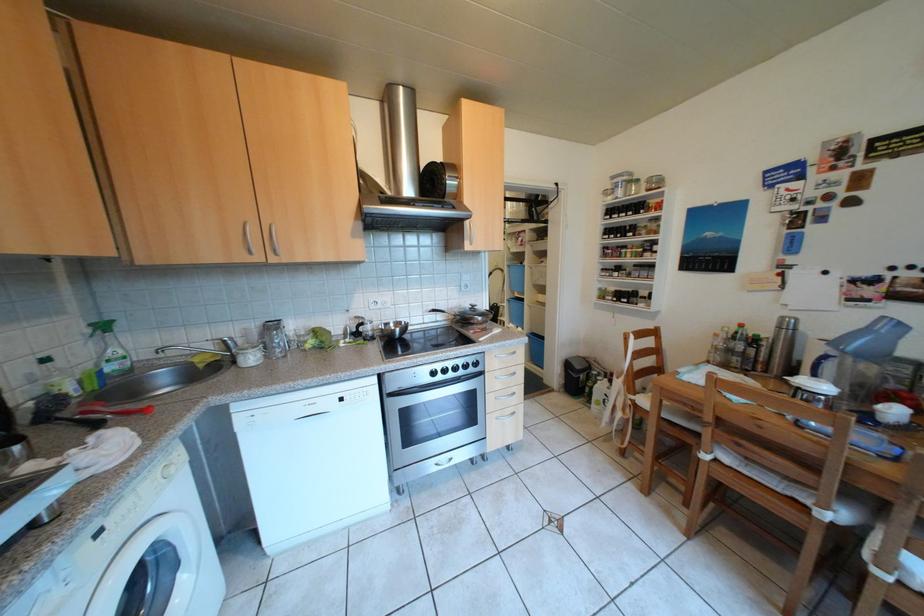
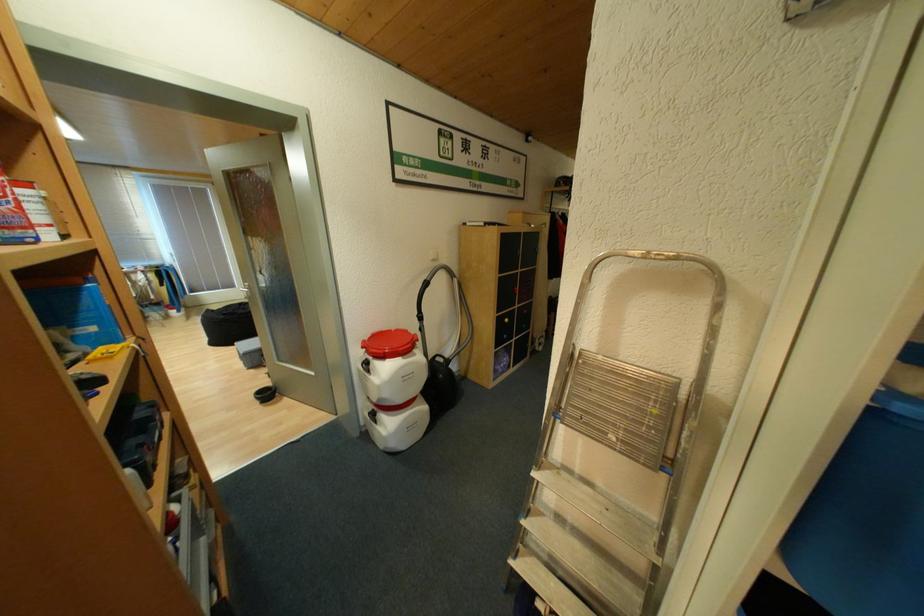
Question: What movement of the cameraman would produce the second image?

Choices:
 (A) Left
 (B) Right
 (C) Forward
 (D) Backward

Answer: (C)